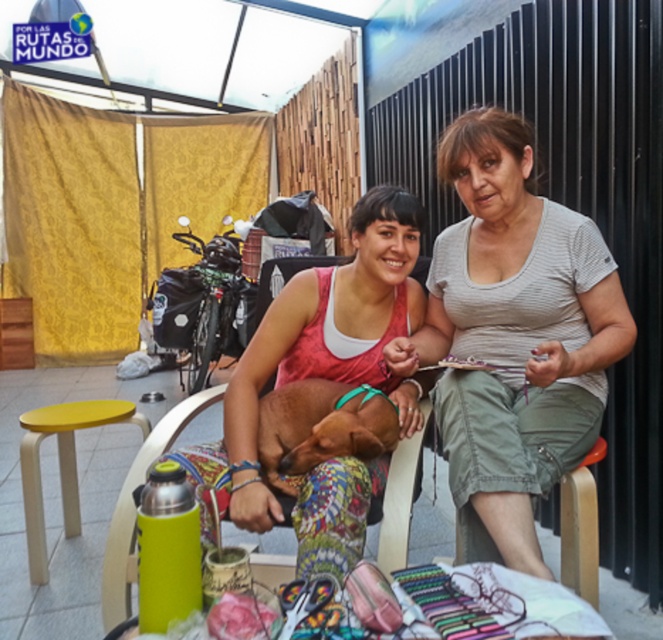
Question: Which point is closer to the camera?

Choices:
 (A) (292, 408)
 (B) (269, 348)

Answer: (A)

Question: Can you confirm if gray striped shirt at center is positioned below matte pink tank top at center?

Choices:
 (A) yes
 (B) no

Answer: (B)

Question: Which object is farther from the camera taking this photo?

Choices:
 (A) brown leather dog at center
 (B) yellow matte stool at lower left
 (C) gray striped shirt at center

Answer: (B)

Question: Among these objects, which one is farthest from the camera?

Choices:
 (A) matte pink tank top at center
 (B) brown leather dog at center

Answer: (B)

Question: Does gray striped shirt at center have a smaller size compared to yellow matte stool at lower left?

Choices:
 (A) no
 (B) yes

Answer: (A)

Question: Can you confirm if gray striped shirt at center is positioned to the right of yellow matte stool at lower left?

Choices:
 (A) no
 (B) yes

Answer: (B)